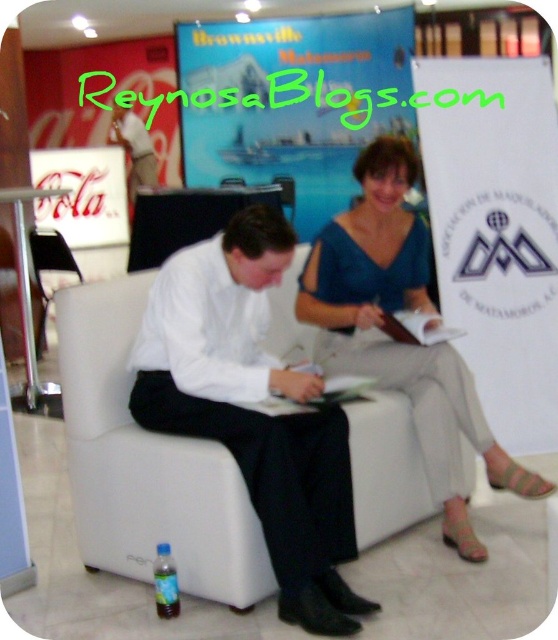
Question: Which point appears closest to the camera in this image?

Choices:
 (A) [x=436, y=486]
 (B) [x=282, y=550]

Answer: (B)

Question: Which point is farther from the camera taking this photo?

Choices:
 (A) (402, 150)
 (B) (300, 497)

Answer: (A)

Question: Is white smooth shirt at center bigger than blue satin blouse at center?

Choices:
 (A) yes
 (B) no

Answer: (B)

Question: Which object is farther from the camera taking this photo?

Choices:
 (A) blue satin blouse at center
 (B) white smooth shirt at center

Answer: (A)

Question: Can you confirm if white smooth shirt at center is positioned to the left of blue satin blouse at center?

Choices:
 (A) yes
 (B) no

Answer: (A)

Question: Is white smooth shirt at center to the right of blue satin blouse at center from the viewer's perspective?

Choices:
 (A) no
 (B) yes

Answer: (A)